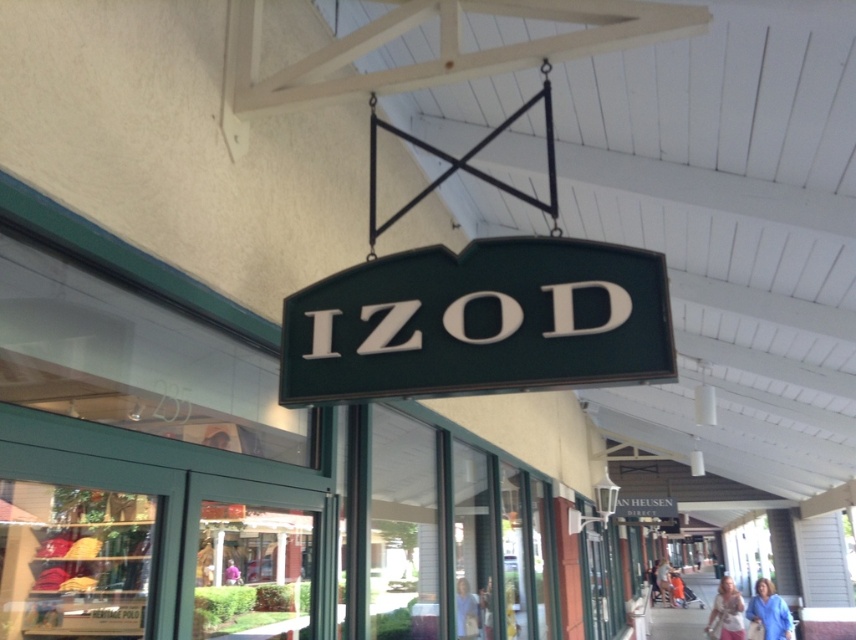
Between light beige blouse at lower right and denim jacket at lower right, which one appears on the left side from the viewer's perspective?

From the viewer's perspective, light beige blouse at lower right appears more on the left side.

Which is more to the right, light beige blouse at lower right or denim jacket at lower right?

Positioned to the right is denim jacket at lower right.

Is point (722, 579) positioned after point (663, 586)?

No, it is not.

Where is `light beige blouse at lower right`? The image size is (856, 640). light beige blouse at lower right is located at coordinates (727, 611).

Does blue cotton shirt at lower right have a smaller size compared to pink fabric at center?

Incorrect, blue cotton shirt at lower right is not smaller in size than pink fabric at center.

Does blue cotton shirt at lower right come behind pink fabric at center?

Yes.

Locate an element on the screen. The image size is (856, 640). blue cotton shirt at lower right is located at coordinates (770, 611).

Is light blue shirt at center thinner than denim jacket at lower right?

Indeed, light blue shirt at center has a lesser width compared to denim jacket at lower right.

Who is positioned more to the right, light blue shirt at center or denim jacket at lower right?

From the viewer's perspective, denim jacket at lower right appears more on the right side.

Where is `light blue shirt at center`? This screenshot has height=640, width=856. light blue shirt at center is located at coordinates (468, 609).